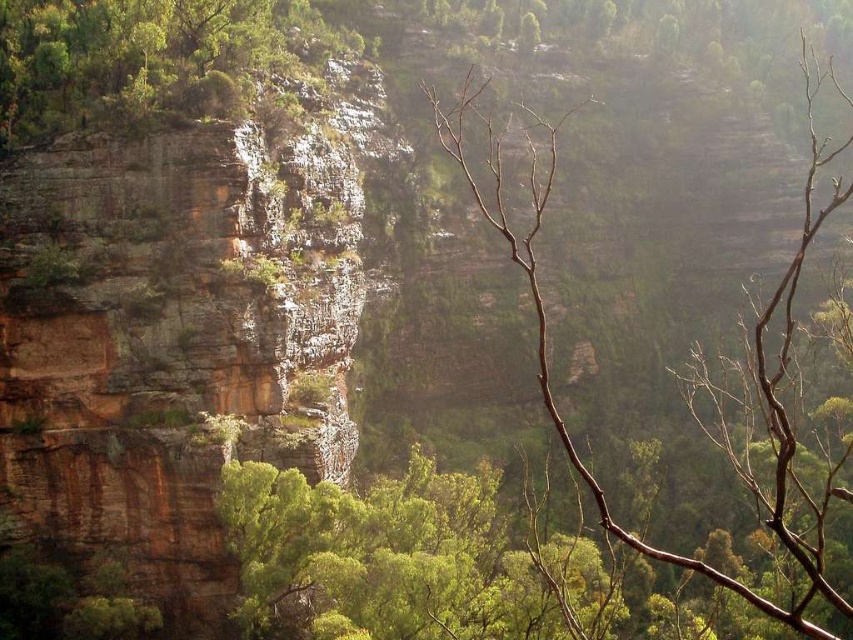
Question: Which point appears farthest from the camera in this image?

Choices:
 (A) (15, 132)
 (B) (161, 202)

Answer: (A)

Question: Can you confirm if rustic stone cliff at center is bigger than green leafy shrub at upper left?

Choices:
 (A) no
 (B) yes

Answer: (B)

Question: Can you confirm if rustic stone cliff at center is thinner than green leafy shrub at upper left?

Choices:
 (A) no
 (B) yes

Answer: (B)

Question: Does rustic stone cliff at center have a larger size compared to green leafy shrub at upper left?

Choices:
 (A) yes
 (B) no

Answer: (A)

Question: Among these objects, which one is nearest to the camera?

Choices:
 (A) rustic stone cliff at center
 (B) green leafy shrub at upper left

Answer: (A)